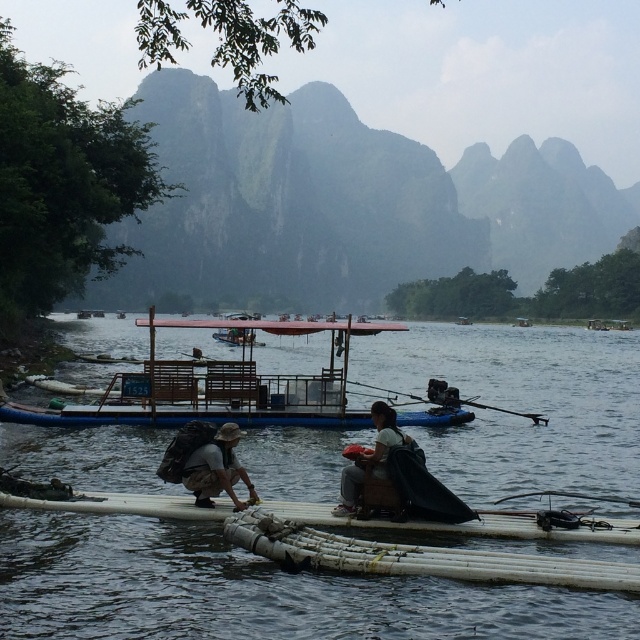
Is white bamboo raft at center smaller than natural bamboo raft at lower center?

No, white bamboo raft at center is not smaller than natural bamboo raft at lower center.

Between point (68, 572) and point (364, 541), which one is positioned behind?

The point (68, 572) is behind.

The width and height of the screenshot is (640, 640). What are the coordinates of `white bamboo raft at center` in the screenshot? It's located at (250, 592).

Does natural bamboo raft at lower center have a greater height compared to matte brown backpack at center?

Correct, natural bamboo raft at lower center is much taller as matte brown backpack at center.

Who is more forward, (394, 550) or (358, 472)?

Point (394, 550) is more forward.

Who is more forward, (548, 557) or (337, 508)?

Point (548, 557) is more forward.

The height and width of the screenshot is (640, 640). I want to click on natural bamboo raft at lower center, so click(x=413, y=556).

Can you confirm if wooden boat at center is taller than brown fabric hat at lower center?

Yes.

What do you see at coordinates (220, 387) in the screenshot?
I see `wooden boat at center` at bounding box center [220, 387].

You are a GUI agent. You are given a task and a screenshot of the screen. Output one action in this format:
    pyautogui.click(x=<x>, y=<y>)
    Task: Click on the wooden boat at center
    The width and height of the screenshot is (640, 640).
    Given the screenshot: What is the action you would take?
    pyautogui.click(x=220, y=387)